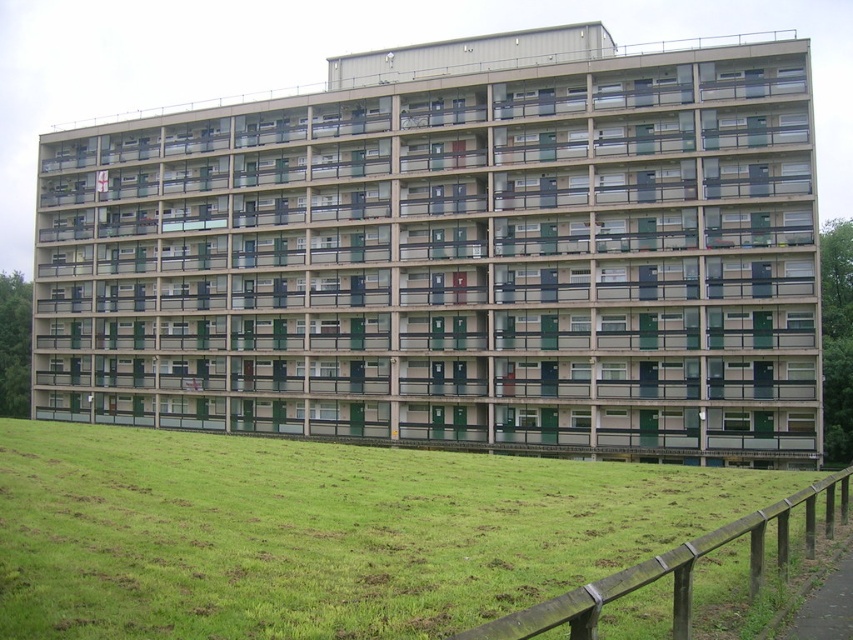
Is point (339, 616) closer to viewer compared to point (491, 632)?

No, it is behind (491, 632).

Is point (125, 474) less distant than point (573, 612)?

No, it is not.

Image resolution: width=853 pixels, height=640 pixels. Find the location of `green grass at lower center`. green grass at lower center is located at coordinates (318, 532).